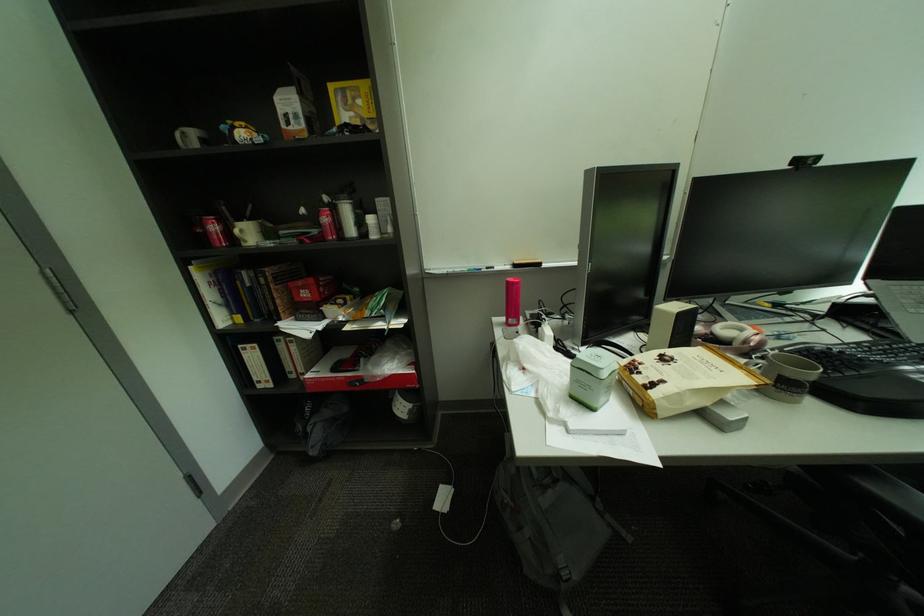
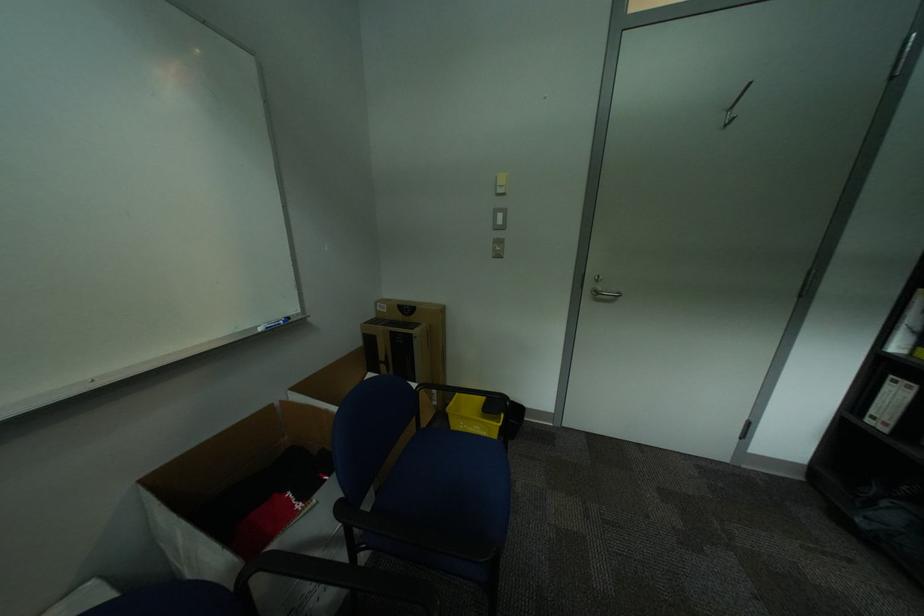
First-person continuous shooting, in which direction is the camera rotating?

The rotation direction of the camera is left-down.